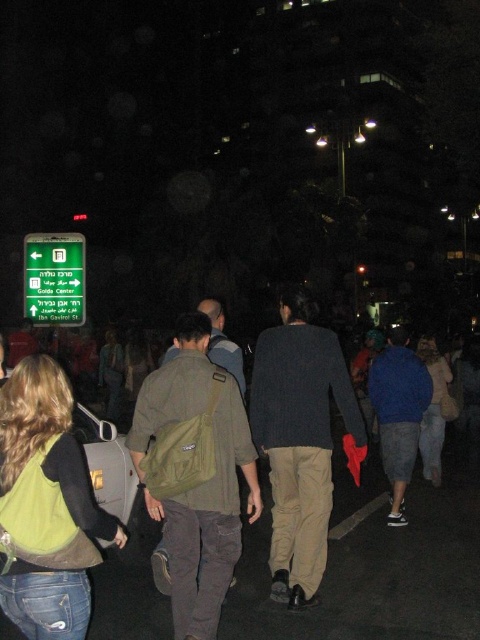
Who is shorter, khaki pants at center or green plastic sign at upper left?

green plastic sign at upper left is shorter.

Is point (298, 506) more distant than point (31, 285)?

No, (298, 506) is in front of (31, 285).

Where is `khaki pants at center`? The height and width of the screenshot is (640, 480). khaki pants at center is located at coordinates (300, 440).

You are a GUI agent. You are given a task and a screenshot of the screen. Output one action in this format:
    pyautogui.click(x=<x>, y=<y>)
    Task: Click on the green fabric backpack at center
    This screenshot has height=640, width=480.
    Given the screenshot: What is the action you would take?
    pyautogui.click(x=373, y=564)

Between green fabric backpack at center and khaki pants at center, which one has less height?

Standing shorter between the two is green fabric backpack at center.

Is green fabric backpack at center taller than khaki pants at center?

In fact, green fabric backpack at center may be shorter than khaki pants at center.

Measure the distance between green fabric backpack at center and camera.

The distance of green fabric backpack at center from camera is 3.90 meters.

Image resolution: width=480 pixels, height=640 pixels. Identify the location of green fabric backpack at center. (373, 564).